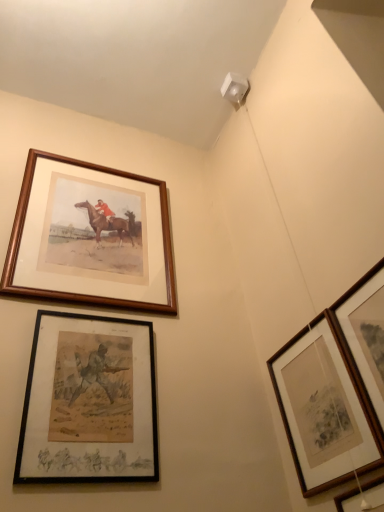
Question: From a real-world perspective, is wooden picture frame at lower right, the 4th picture frame viewed from the left, under black matte picture frame at lower left, which is the 2th picture frame from left to right?

Choices:
 (A) yes
 (B) no

Answer: (A)

Question: Would you say wooden picture frame at lower right, arranged as the second picture frame when viewed from the right, contains black matte picture frame at lower left, which is the 2th picture frame from left to right?

Choices:
 (A) no
 (B) yes

Answer: (A)

Question: Does wooden picture frame at lower right, arranged as the second picture frame when viewed from the right, touch black matte picture frame at lower left, which ranks as the 4th picture frame in right-to-left order?

Choices:
 (A) yes
 (B) no

Answer: (B)

Question: Is wooden picture frame at lower right, arranged as the second picture frame when viewed from the right, positioned in front of black matte picture frame at lower left, which ranks as the 4th picture frame in right-to-left order?

Choices:
 (A) no
 (B) yes

Answer: (B)

Question: Considering the relative sizes of wooden picture frame at lower right, arranged as the second picture frame when viewed from the right, and black matte picture frame at lower left, which is the 2th picture frame from left to right, in the image provided, is wooden picture frame at lower right, arranged as the second picture frame when viewed from the right, shorter than black matte picture frame at lower left, which is the 2th picture frame from left to right,?

Choices:
 (A) no
 (B) yes

Answer: (B)

Question: Considering the positions of point (372, 498) and point (64, 428), is point (372, 498) closer or farther from the camera than point (64, 428)?

Choices:
 (A) farther
 (B) closer

Answer: (B)

Question: Is wooden picture frame at lower right, the 4th picture frame viewed from the left, to the left or to the right of black matte picture frame at lower left, which is the 2th picture frame from left to right, in the image?

Choices:
 (A) right
 (B) left

Answer: (A)

Question: Looking at the image, does wooden picture frame at lower right, the 4th picture frame viewed from the left, seem bigger or smaller compared to black matte picture frame at lower left, which is the 2th picture frame from left to right?

Choices:
 (A) big
 (B) small

Answer: (A)

Question: In the image, is wooden picture frame at lower right, arranged as the second picture frame when viewed from the right, positioned in front of or behind black matte picture frame at lower left, which ranks as the 4th picture frame in right-to-left order?

Choices:
 (A) behind
 (B) front

Answer: (B)

Question: From a real-world perspective, is wooden picture frame at upper right, marked as the fifth picture frame in a left-to-right arrangement, positioned above or below black matte picture frame at lower left, which is the 2th picture frame from left to right?

Choices:
 (A) above
 (B) below

Answer: (B)

Question: Is wooden picture frame at upper right, marked as the fifth picture frame in a left-to-right arrangement, inside or outside of black matte picture frame at lower left, which ranks as the 4th picture frame in right-to-left order?

Choices:
 (A) inside
 (B) outside

Answer: (B)

Question: Looking at the image, does wooden picture frame at upper right, marked as the fifth picture frame in a left-to-right arrangement, seem bigger or smaller compared to black matte picture frame at lower left, which is the 2th picture frame from left to right?

Choices:
 (A) small
 (B) big

Answer: (A)

Question: Is wooden picture frame at upper right, marked as the fifth picture frame in a left-to-right arrangement, taller or shorter than black matte picture frame at lower left, which is the 2th picture frame from left to right?

Choices:
 (A) tall
 (B) short

Answer: (B)

Question: Is wooden picture frame at lower right, arranged as the second picture frame when viewed from the right, inside or outside of wooden framed print at lower right, which is the third picture frame in right-to-left order?

Choices:
 (A) outside
 (B) inside

Answer: (A)

Question: Considering the positions of wooden picture frame at lower right, arranged as the second picture frame when viewed from the right, and wooden framed print at lower right, which is the third picture frame in right-to-left order, in the image, is wooden picture frame at lower right, arranged as the second picture frame when viewed from the right, taller or shorter than wooden framed print at lower right, which is the third picture frame in right-to-left order,?

Choices:
 (A) short
 (B) tall

Answer: (A)